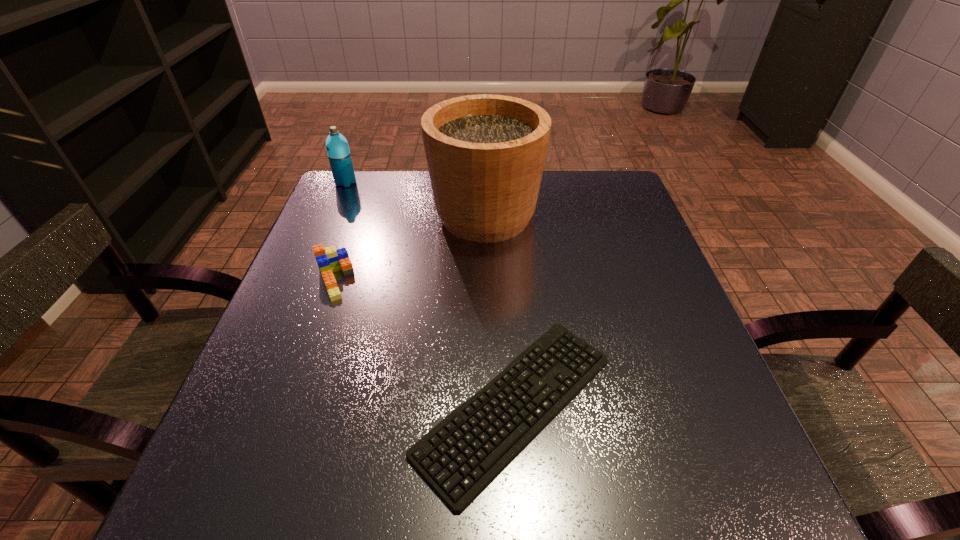
Identify the location of blank region between the tallest object and the third shortest object. The image size is (960, 540). (416, 199).

You are a GUI agent. You are given a task and a screenshot of the screen. Output one action in this format:
    pyautogui.click(x=<x>, y=<y>)
    Task: Click on the free space that is in between the third shortest object and the second shortest object
    
    Given the screenshot: What is the action you would take?
    pyautogui.click(x=340, y=231)

I want to click on free space between the tallest object and the shortest object, so click(x=500, y=310).

This screenshot has width=960, height=540. In order to click on object that is the closest one to the tallest object in this screenshot , I will do `click(329, 260)`.

Locate which object ranks third in proximity to the third tallest object. Please provide its 2D coordinates. Your answer should be formatted as a tuple, i.e. [(x, y)], where the tuple contains the x and y coordinates of a point satisfying the conditions above.

[(337, 147)]

Where is `blank space that satisfies the following two spatial constraints: 1. on the front side of the thermos bottle; 2. on the left side of the flowerpot`? blank space that satisfies the following two spatial constraints: 1. on the front side of the thermos bottle; 2. on the left side of the flowerpot is located at coordinates (x=332, y=215).

The image size is (960, 540). What are the coordinates of `free spot that satisfies the following two spatial constraints: 1. on the front side of the third tallest object; 2. on the left side of the computer keyboard` in the screenshot? It's located at (290, 404).